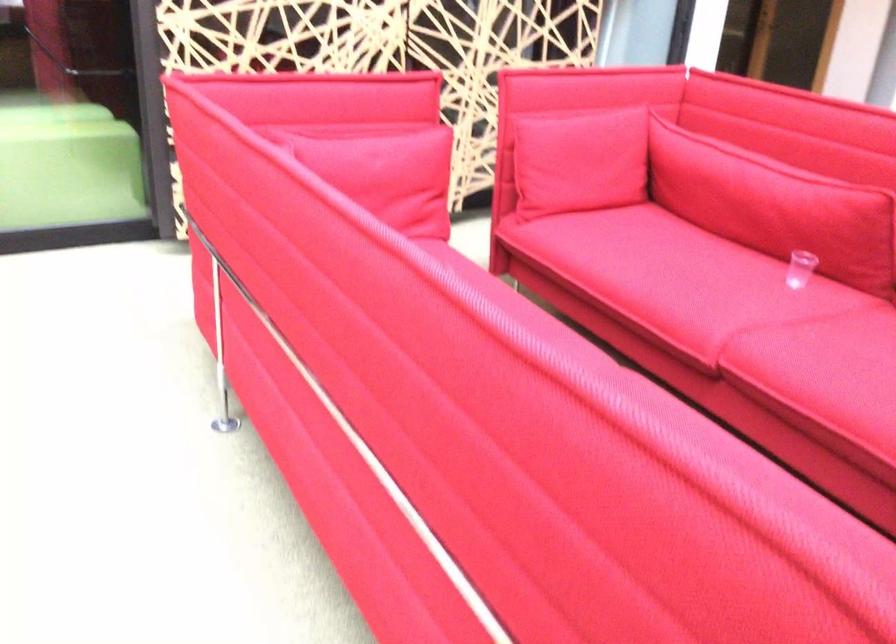
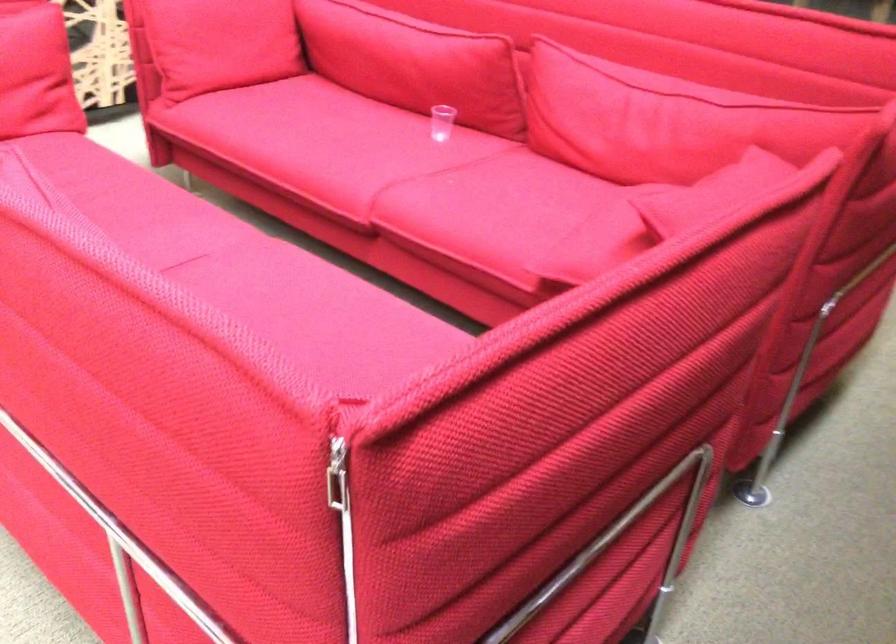
Locate, in the second image, the point that corresponds to (x=791, y=261) in the first image.

(442, 122)